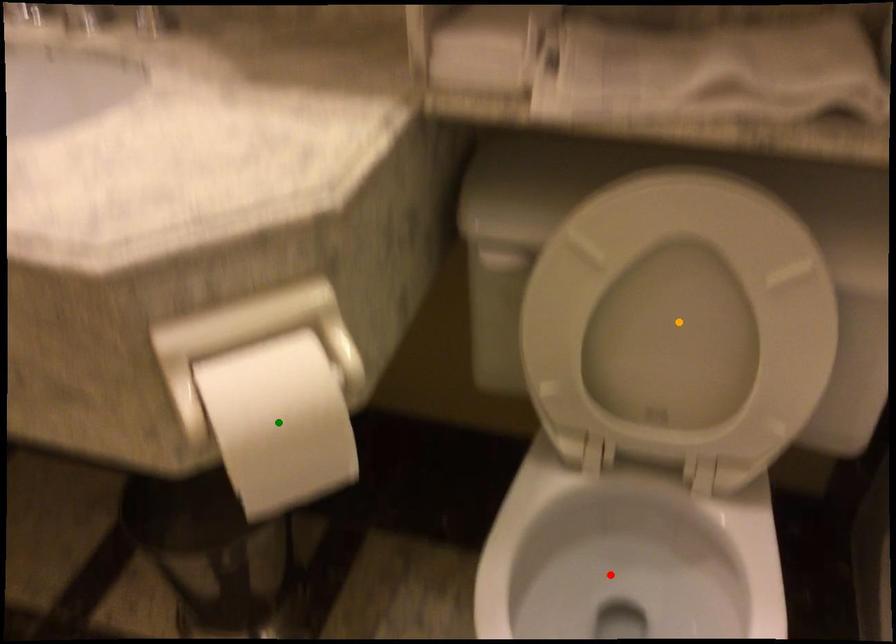
Order these from nearest to farthest:
orange point
green point
red point

green point → orange point → red point